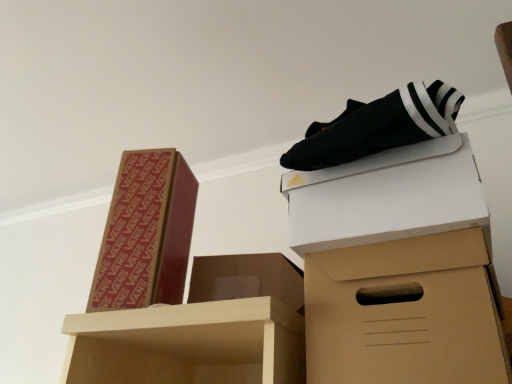
Image resolution: width=512 pixels, height=384 pixels. What do you see at coordinates (247, 279) in the screenshot?
I see `brown cardboard box at center, marked as the 2th box in a left-to-right arrangement` at bounding box center [247, 279].

The image size is (512, 384). I want to click on white cardboard box at upper right, the first box positioned from the right, so click(x=386, y=196).

Locate an element on the screen. cardboard box on the right side of brown cardboard box at center, marked as the 2th box in a left-to-right arrangement is located at coordinates (398, 268).

From the image's perspective, who appears lower, brown cardboard box at center, marked as the 2th box in a left-to-right arrangement, or brown cardboard box at lower right?

From the image's view, brown cardboard box at lower right is below.

Between brown cardboard box at center, marked as the 2th box in a left-to-right arrangement, and brown cardboard box at lower right, which one has larger width?

Wider between the two is brown cardboard box at lower right.

Is brown cardboard box at center, the second box viewed from the right, positioned before brown cardboard box at lower right?

No, the depth of brown cardboard box at center, the second box viewed from the right, is greater than that of brown cardboard box at lower right.

Is point (278, 299) positioned after point (170, 218)?

No.

Is brown cardboard box at upper left, arranged as the 3th box when viewed from the right, at the back of brown cardboard box at center, the second box viewed from the right?

No, brown cardboard box at center, the second box viewed from the right, is not facing the opposite direction of brown cardboard box at upper left, arranged as the 3th box when viewed from the right.

Between brown cardboard box at center, the second box viewed from the right, and brown cardboard box at upper left, the first box positioned from the left, which one has less height?

brown cardboard box at center, the second box viewed from the right, is shorter.

How far apart are brown cardboard box at center, the second box viewed from the right, and brown cardboard box at upper left, the first box positioned from the left?

5.98 inches.

Between white cardboard box at upper right, which ranks as the third box in left-to-right order, and brown cardboard box at lower right, which one appears on the right side from the viewer's perspective?

brown cardboard box at lower right is more to the right.

Looking at the image, does white cardboard box at upper right, which ranks as the third box in left-to-right order, seem bigger or smaller compared to brown cardboard box at lower right?

Clearly, white cardboard box at upper right, which ranks as the third box in left-to-right order, is smaller in size than brown cardboard box at lower right.

Is point (415, 174) closer to viewer compared to point (431, 289)?

No, (415, 174) is behind (431, 289).

From a real-world perspective, is white cardboard box at upper right, which ranks as the third box in left-to-right order, below brown cardboard box at lower right?

No, from a real-world perspective, white cardboard box at upper right, which ranks as the third box in left-to-right order, is not below brown cardboard box at lower right.

Is brown cardboard box at center, marked as the 2th box in a left-to-right arrangement, positioned far away from white cardboard box at upper right, the first box positioned from the right?

No, there isn't a large distance between brown cardboard box at center, marked as the 2th box in a left-to-right arrangement, and white cardboard box at upper right, the first box positioned from the right.

From the white cardboard box at upper right, which ranks as the third box in left-to-right order, count 2nd boxs backward and point to it. Please provide its 2D coordinates.

[(247, 279)]

From a real-world perspective, which object rests below the other?

In real-world perspective, brown cardboard box at center, the second box viewed from the right, is lower.

How much distance is there between brown cardboard box at lower right and brown cardboard box at upper left, arranged as the 3th box when viewed from the right?

brown cardboard box at lower right is 14.13 inches from brown cardboard box at upper left, arranged as the 3th box when viewed from the right.

Which of these two, brown cardboard box at lower right or brown cardboard box at upper left, the first box positioned from the left, is bigger?

With larger size is brown cardboard box at lower right.

Looking at this image, from the image's perspective, is brown cardboard box at lower right located above or below brown cardboard box at upper left, the first box positioned from the left?

Clearly, from the image's perspective, brown cardboard box at lower right is below brown cardboard box at upper left, the first box positioned from the left.

From a real-world perspective, is brown cardboard box at lower right over brown cardboard box at upper left, arranged as the 3th box when viewed from the right?

No.

Identify the location of the 1st box to the left when counting from the brown cardboard box at lower right. The width and height of the screenshot is (512, 384). (x=386, y=196).

How different are the orientations of brown cardboard box at lower right and white cardboard box at upper right, the first box positioned from the right, in degrees?

2.44 degrees.

Does brown cardboard box at lower right touch white cardboard box at upper right, the first box positioned from the right?

Yes, brown cardboard box at lower right is right next to white cardboard box at upper right, the first box positioned from the right, and making contact.

Which is more to the right, brown cardboard box at lower right or white cardboard box at upper right, the first box positioned from the right?

Positioned to the right is brown cardboard box at lower right.

Is brown cardboard box at upper left, the first box positioned from the left, shorter than brown cardboard box at center, the second box viewed from the right?

No, brown cardboard box at upper left, the first box positioned from the left, is not shorter than brown cardboard box at center, the second box viewed from the right.

Is brown cardboard box at upper left, the first box positioned from the left, positioned far away from brown cardboard box at center, marked as the 2th box in a left-to-right arrangement?

No, brown cardboard box at upper left, the first box positioned from the left, is not far from brown cardboard box at center, marked as the 2th box in a left-to-right arrangement.

Can brown cardboard box at center, marked as the 2th box in a left-to-right arrangement, be found inside brown cardboard box at upper left, arranged as the 3th box when viewed from the right?

No, brown cardboard box at center, marked as the 2th box in a left-to-right arrangement, is not a part of brown cardboard box at upper left, arranged as the 3th box when viewed from the right.

Is brown cardboard box at upper left, arranged as the 3th box when viewed from the right, thinner than brown cardboard box at center, marked as the 2th box in a left-to-right arrangement?

Incorrect, the width of brown cardboard box at upper left, arranged as the 3th box when viewed from the right, is not less than that of brown cardboard box at center, marked as the 2th box in a left-to-right arrangement.

In order to click on cardboard box below the brown cardboard box at center, the second box viewed from the right (from a real-world perspective) in this screenshot , I will do `click(398, 268)`.

From the brown cardboard box at upper left, the first box positioned from the left, count 1st box to the right and point to it. Please provide its 2D coordinates.

[(247, 279)]

Looking at this image, looking at the image, which one is located closer to brown cardboard box at upper left, arranged as the 3th box when viewed from the right, brown cardboard box at lower right or white cardboard box at upper right, the first box positioned from the right?

The object closer to brown cardboard box at upper left, arranged as the 3th box when viewed from the right, is white cardboard box at upper right, the first box positioned from the right.

Estimate the real-world distances between objects in this image. Which object is closer to brown cardboard box at center, the second box viewed from the right, white cardboard box at upper right, which ranks as the third box in left-to-right order, or brown cardboard box at upper left, arranged as the 3th box when viewed from the right?

brown cardboard box at upper left, arranged as the 3th box when viewed from the right, is positioned closer to the anchor brown cardboard box at center, the second box viewed from the right.

Looking at the image, which one is located closer to brown cardboard box at lower right, white cardboard box at upper right, the first box positioned from the right, or brown cardboard box at center, marked as the 2th box in a left-to-right arrangement?

Among the two, white cardboard box at upper right, the first box positioned from the right, is located nearer to brown cardboard box at lower right.

Estimate the real-world distances between objects in this image. Which object is further from brown cardboard box at center, marked as the 2th box in a left-to-right arrangement, brown cardboard box at upper left, the first box positioned from the left, or white cardboard box at upper right, the first box positioned from the right?

white cardboard box at upper right, the first box positioned from the right, lies further to brown cardboard box at center, marked as the 2th box in a left-to-right arrangement, than the other object.

Considering their positions, is brown cardboard box at lower right positioned closer to white cardboard box at upper right, which ranks as the third box in left-to-right order, than brown cardboard box at center, marked as the 2th box in a left-to-right arrangement?

Among the two, brown cardboard box at lower right is located nearer to white cardboard box at upper right, which ranks as the third box in left-to-right order.

Based on their spatial positions, is brown cardboard box at lower right or white cardboard box at upper right, which ranks as the third box in left-to-right order, further from brown cardboard box at center, marked as the 2th box in a left-to-right arrangement?

white cardboard box at upper right, which ranks as the third box in left-to-right order, lies further to brown cardboard box at center, marked as the 2th box in a left-to-right arrangement, than the other object.

When comparing their distances from brown cardboard box at lower right, does brown cardboard box at center, the second box viewed from the right, or brown cardboard box at upper left, arranged as the 3th box when viewed from the right, seem closer?

brown cardboard box at center, the second box viewed from the right, is closer to brown cardboard box at lower right.

Which object lies nearer to the anchor point brown cardboard box at center, the second box viewed from the right, white cardboard box at upper right, which ranks as the third box in left-to-right order, or brown cardboard box at lower right?

Based on the image, brown cardboard box at lower right appears to be nearer to brown cardboard box at center, the second box viewed from the right.

The width and height of the screenshot is (512, 384). What are the coordinates of `box between brown cardboard box at upper left, the first box positioned from the left, and white cardboard box at upper right, which ranks as the third box in left-to-right order` in the screenshot? It's located at (247, 279).